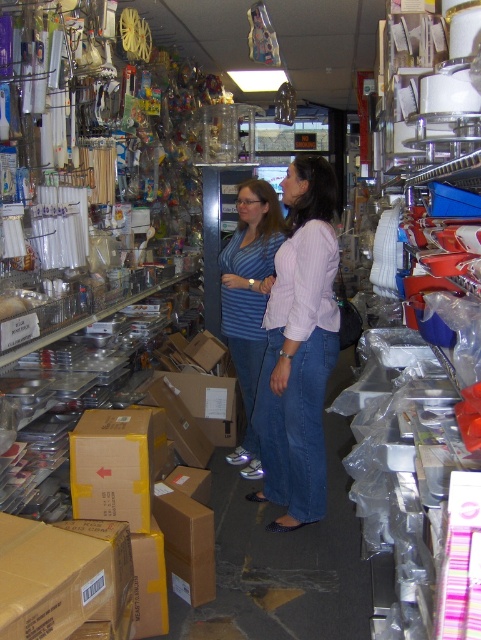
Image resolution: width=481 pixels, height=640 pixels. What do you see at coordinates (299, 349) in the screenshot?
I see `light purple shirt at center` at bounding box center [299, 349].

Measure the distance between point [249,499] and camera.

They are 3.16 meters apart.

Is point (283, 522) closer to viewer compared to point (109, 429)?

No, (283, 522) is further to viewer.

Identify the location of light purple shirt at center. (299, 349).

Between light purple shirt at center and blue striped shirt at center, which one appears on the left side from the viewer's perspective?

From the viewer's perspective, blue striped shirt at center appears more on the left side.

Is light purple shirt at center taller than blue striped shirt at center?

Yes, light purple shirt at center is taller than blue striped shirt at center.

Who is more distant from viewer, (266, 429) or (243, 252)?

The point (243, 252) is more distant.

The image size is (481, 640). I want to click on light purple shirt at center, so [299, 349].

Between blue striped shirt at center and yellow cardboard box at center, which one is positioned higher?

blue striped shirt at center is higher up.

Who is positioned more to the right, blue striped shirt at center or yellow cardboard box at center?

Positioned to the right is blue striped shirt at center.

Between point (253, 364) and point (104, 436), which one is positioned behind?

The point (253, 364) is behind.

I want to click on blue striped shirt at center, so click(249, 300).